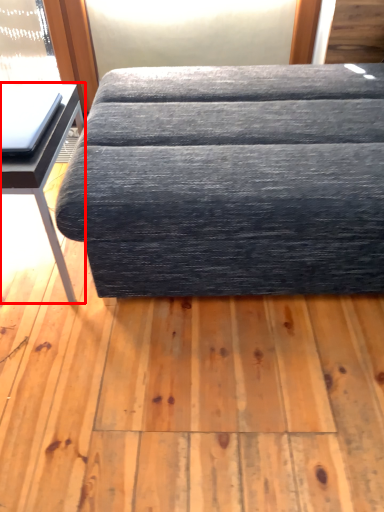
Question: In this image, where is table (annotated by the red box) located relative to studio couch?

Choices:
 (A) left
 (B) right

Answer: (A)